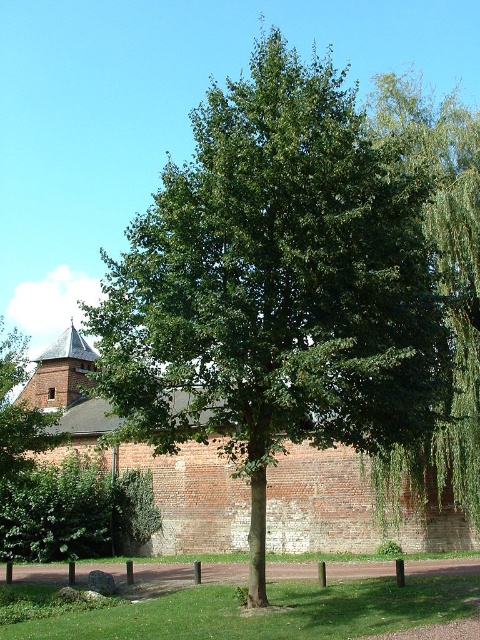
Which is below, green leafy tree at center or green leafy hedge at center?

green leafy hedge at center

Can you confirm if green leafy tree at center is positioned above green leafy hedge at center?

Yes.

Which is behind, point (142, 225) or point (51, 547)?

The point (51, 547) is more distant.

The width and height of the screenshot is (480, 640). I want to click on green leafy tree at center, so click(x=275, y=285).

Between green leafy tree at center and green leafy tree at upper left, which one appears on the left side from the viewer's perspective?

Positioned to the left is green leafy tree at upper left.

Which of these two, green leafy tree at center or green leafy tree at upper left, stands taller?

Standing taller between the two is green leafy tree at center.

Who is more forward, (103, 280) or (11, 419)?

Positioned in front is point (11, 419).

Where is `green leafy tree at center`? green leafy tree at center is located at coordinates (275, 285).

Does green leafy hedge at center appear over green leafy tree at upper left?

Incorrect, green leafy hedge at center is not positioned above green leafy tree at upper left.

Can you confirm if green leafy hedge at center is taller than green leafy tree at upper left?

No, green leafy hedge at center is not taller than green leafy tree at upper left.

The width and height of the screenshot is (480, 640). Find the location of `green leafy hedge at center`. green leafy hedge at center is located at coordinates (74, 512).

I want to click on green leafy hedge at center, so click(74, 512).